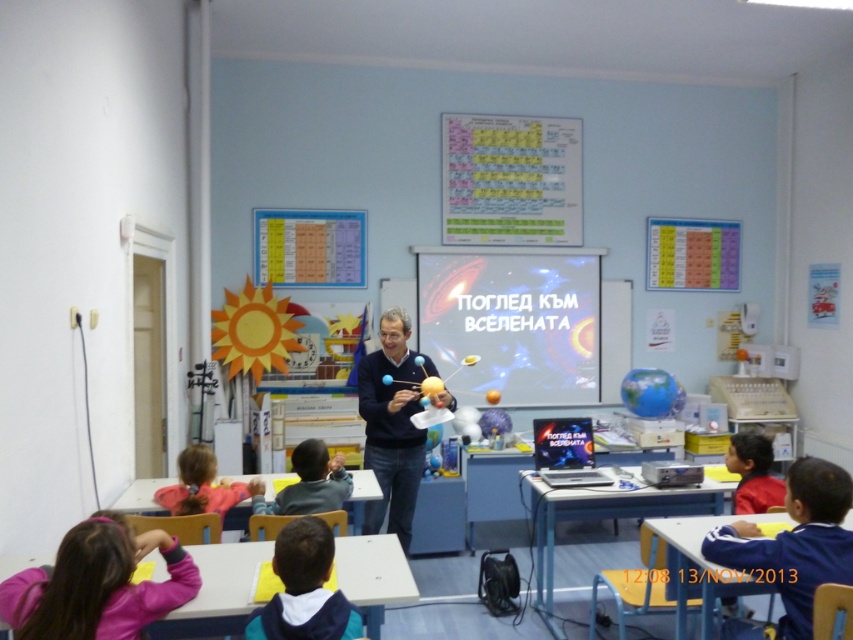
Question: Which of the following is the farthest from the observer?

Choices:
 (A) (398, 337)
 (B) (322, 552)
 (C) (599, 257)

Answer: (C)

Question: Considering the real-world distances, which object is closest to the yellow paper at upper center?

Choices:
 (A) metallic silver projector screen at center
 (B) pink fabric hairband at lower left

Answer: (A)

Question: Does matte black sweater at center have a lesser width compared to red matte shirt at lower right?

Choices:
 (A) yes
 (B) no

Answer: (B)

Question: Is blue fabric jacket at lower right thinner than red matte shirt at lower right?

Choices:
 (A) no
 (B) yes

Answer: (A)

Question: Among these objects, which one is farthest from the camera?

Choices:
 (A) matte black sweater at center
 (B) blue fabric jacket at lower right
 (C) pink fabric hairband at lower left
 (D) blue fleece jacket at lower center

Answer: (A)

Question: Does blue fabric jacket at lower right lie behind matte black sweater at center?

Choices:
 (A) yes
 (B) no

Answer: (B)